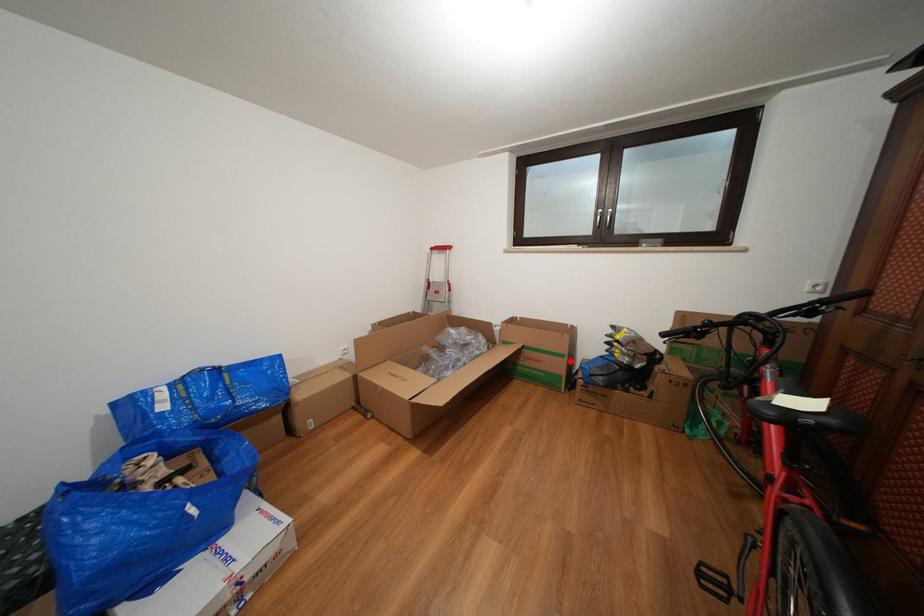
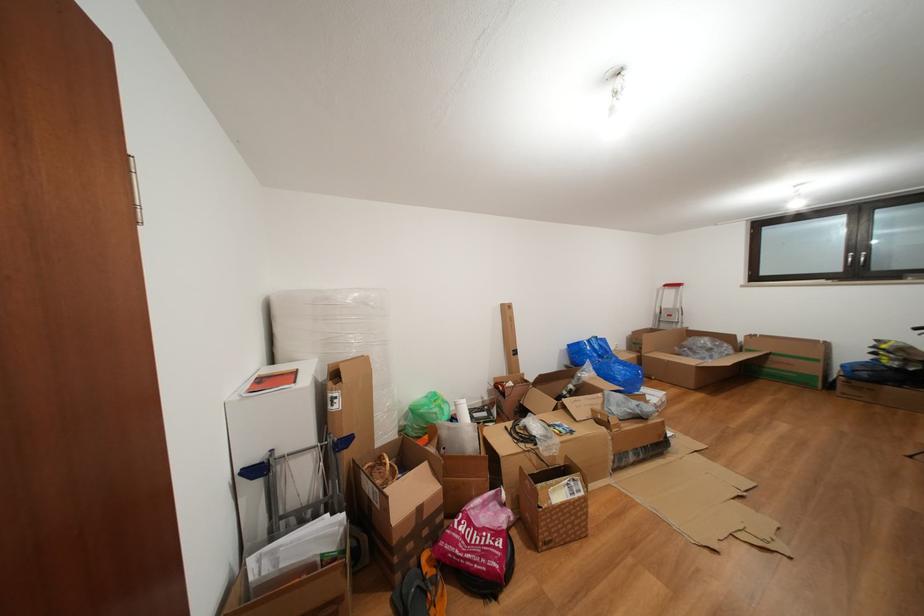
Question: I am providing you with two images of the same scene from different viewpoints. A red point is shown in image1. For the corresponding object point in image2, is it positioned nearer or farther from the camera?

Choices:
 (A) Nearer
 (B) Farther

Answer: (B)